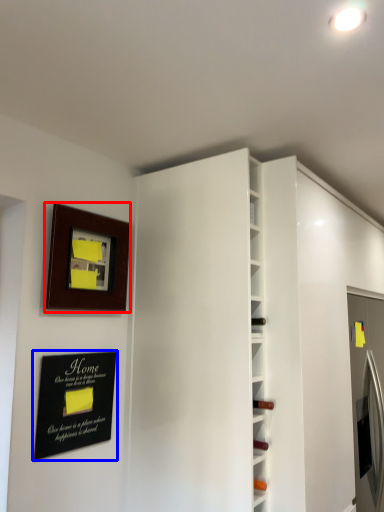
Question: Which object is further to the camera taking this photo, picture frame (highlighted by a red box) or plaque (highlighted by a blue box)?

Choices:
 (A) picture frame
 (B) plaque

Answer: (A)